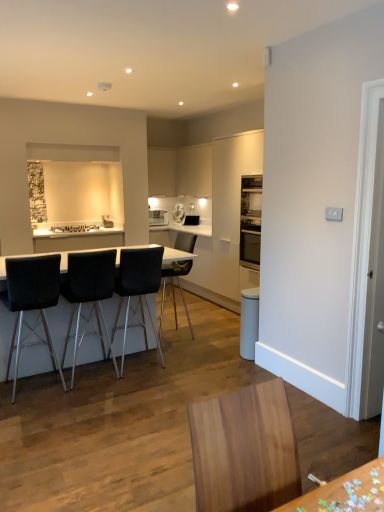
Identify the location of free space in front of black leather chair at center, marked as the fourth chair in a left-to-right arrangement. The height and width of the screenshot is (512, 384). (191, 348).